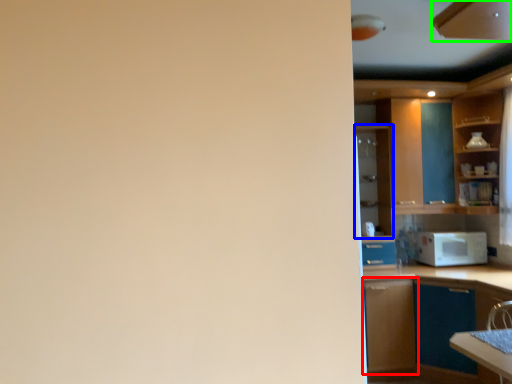
Question: Which object is positioned farthest from cabinetry (highlighted by a red box)? Select from cabinetry (highlighted by a blue box) and cabinetry (highlighted by a green box).

Choices:
 (A) cabinetry
 (B) cabinetry

Answer: (B)